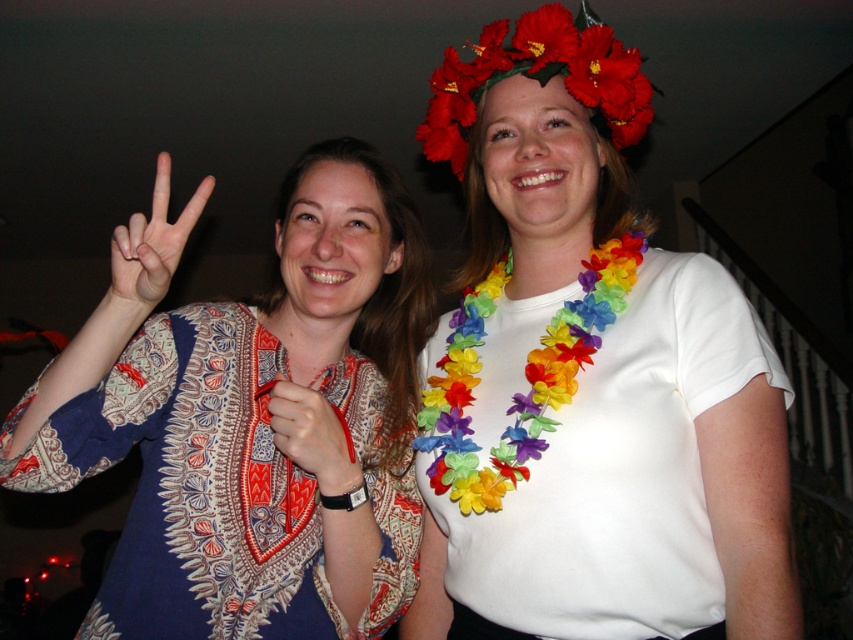
Looking at this image, is white fabric lei at upper right shorter than patterned fabric shirt at center?

In fact, white fabric lei at upper right may be taller than patterned fabric shirt at center.

Who is more forward, (669, 547) or (234, 595)?

Point (669, 547)

Is point (602, 420) in front of point (386, 180)?

Yes, it is.

Find the location of `white fabric lei at upper right`. white fabric lei at upper right is located at coordinates (589, 376).

Who is higher up, rainbow fabric lei at center or floral crown at upper center?

floral crown at upper center

Based on the photo, who is more forward, (485, 468) or (537, 51)?

Point (485, 468) is in front.

In order to click on rainbow fabric lei at center in this screenshot , I will do `click(524, 376)`.

Is matte white hand at center wider than matte fabric hand at center?

Yes, matte white hand at center is wider than matte fabric hand at center.

This screenshot has width=853, height=640. Identify the location of matte white hand at center. (149, 250).

Is point (166, 253) less distant than point (352, 458)?

Yes, it is in front of point (352, 458).

Where is `matte white hand at center`? The height and width of the screenshot is (640, 853). matte white hand at center is located at coordinates (149, 250).